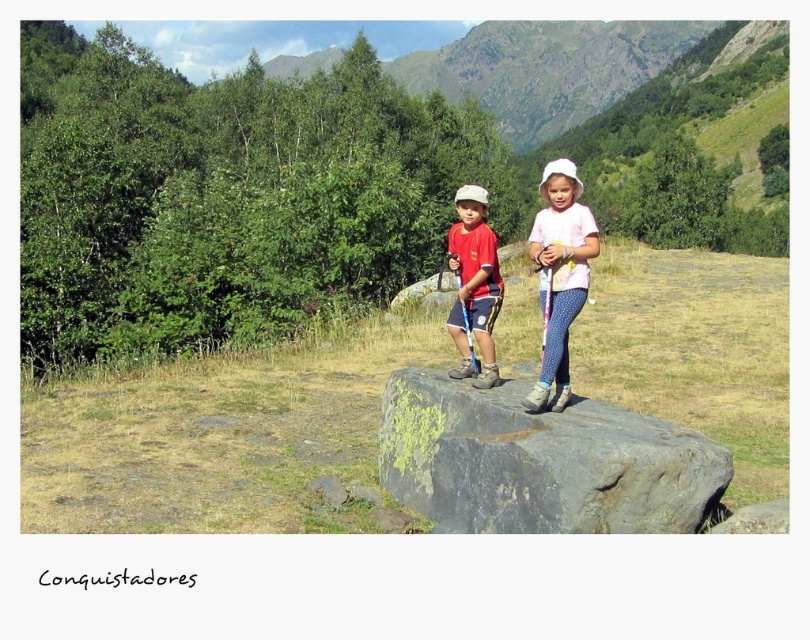
Does gray rough boulder at center have a smaller size compared to white dotted leggings at center?

Indeed, gray rough boulder at center has a smaller size compared to white dotted leggings at center.

How distant is gray rough boulder at center from white dotted leggings at center?

gray rough boulder at center is 1.27 meters from white dotted leggings at center.

In the scene shown: Who is more forward, (676, 426) or (557, 269)?

Point (676, 426) is in front.

Locate an element on the screen. The height and width of the screenshot is (640, 810). gray rough boulder at center is located at coordinates (540, 461).

Which of these two, gray rough boulder at center or matte red shirt at center, stands taller?

Standing taller between the two is matte red shirt at center.

Is gray rough boulder at center positioned at the back of matte red shirt at center?

No.

Locate an element on the screen. This screenshot has width=810, height=640. gray rough boulder at center is located at coordinates (540, 461).

Is white dotted leggings at center below matte red shirt at center?

Yes, white dotted leggings at center is below matte red shirt at center.

Between white dotted leggings at center and matte red shirt at center, which one appears on the right side from the viewer's perspective?

white dotted leggings at center is more to the right.

Is point (544, 353) positioned before point (486, 371)?

That is True.

Find the location of a particular element. white dotted leggings at center is located at coordinates (559, 275).